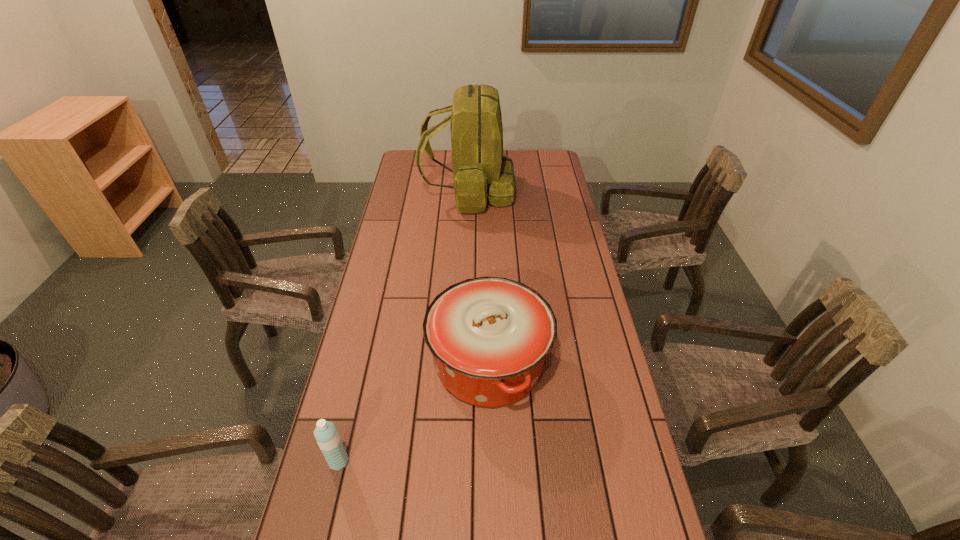
I want to click on free spot between the backpack and the second tallest object, so click(x=479, y=277).

You are a GUI agent. You are given a task and a screenshot of the screen. Output one action in this format:
    pyautogui.click(x=<x>, y=<y>)
    Task: Click on the vacant space that is in between the tallest object and the second shortest object
    
    Given the screenshot: What is the action you would take?
    pyautogui.click(x=479, y=277)

Locate an element on the screen. The width and height of the screenshot is (960, 540). vacant area that lies between the backpack and the leftmost object is located at coordinates (403, 327).

This screenshot has width=960, height=540. Find the location of `free space between the casserole and the nearest object`. free space between the casserole and the nearest object is located at coordinates (414, 413).

Locate an element on the screen. The width and height of the screenshot is (960, 540). vacant area that lies between the tallest object and the second shortest object is located at coordinates (479, 277).

This screenshot has height=540, width=960. I want to click on vacant region between the water bottle and the farthest object, so pos(403,327).

Where is `empty location between the casserole and the backpack`? This screenshot has width=960, height=540. empty location between the casserole and the backpack is located at coordinates (479, 277).

Find the location of a particular element. This screenshot has width=960, height=540. free spot between the casserole and the farthest object is located at coordinates (479, 277).

I want to click on object that can be found as the closest to the second farthest object, so click(x=327, y=437).

Where is `the closest object to the second farthest object`? the closest object to the second farthest object is located at coordinates (327, 437).